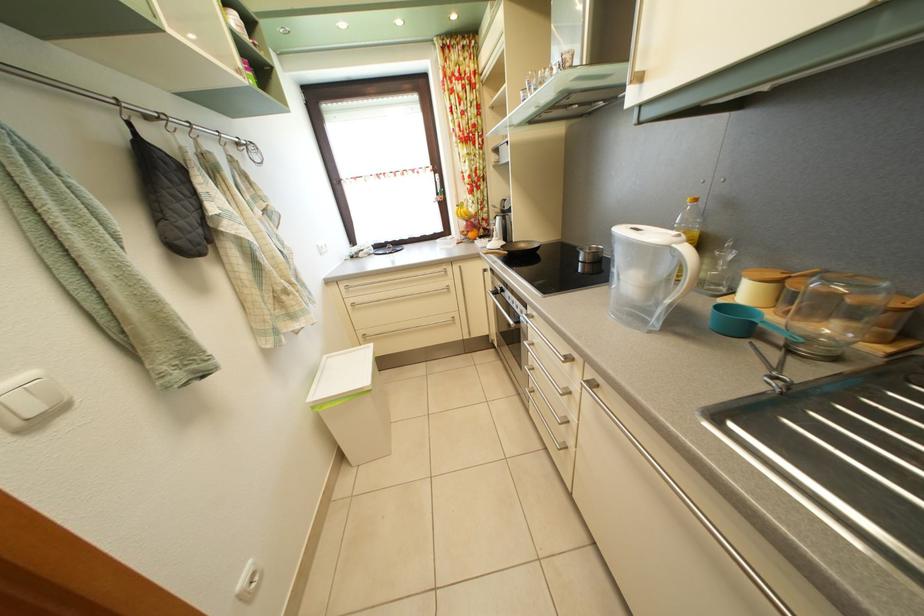
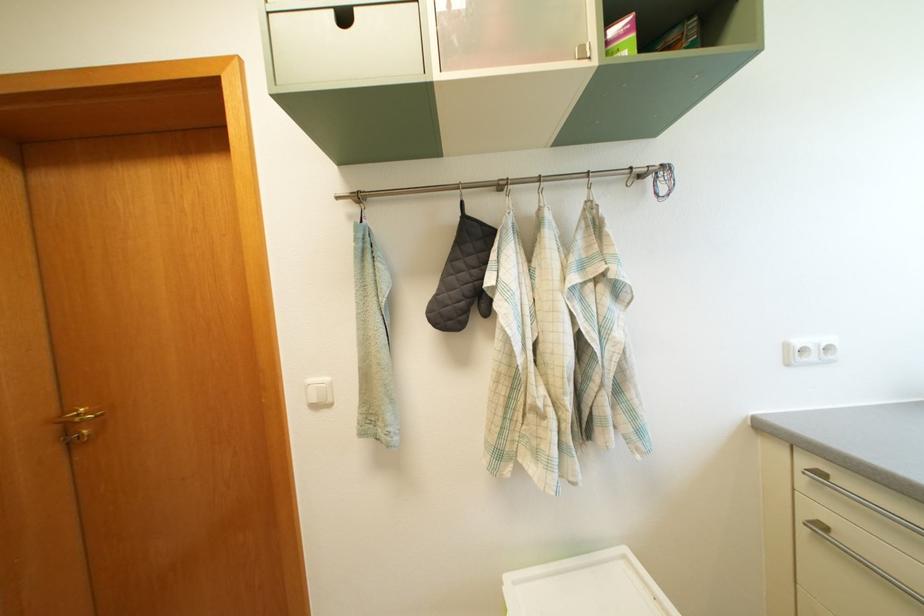
Question: The camera is either moving clockwise (left) or counter-clockwise (right) around the object. The first image is from the beginning of the video and the second image is from the end. Is the camera moving left or right when shooting the video?

Choices:
 (A) Left
 (B) Right

Answer: (B)